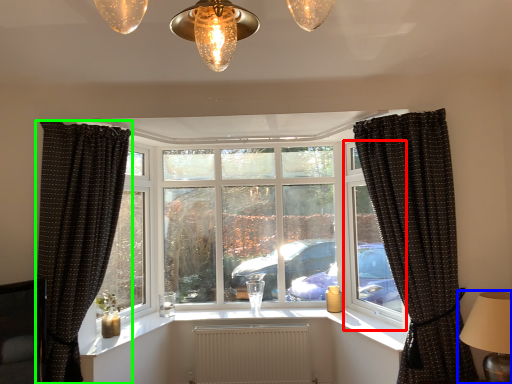
Question: Which is nearer to the window frame (highlighted by a red box)? table lamp (highlighted by a blue box) or curtain (highlighted by a green box).

Choices:
 (A) table lamp
 (B) curtain

Answer: (A)